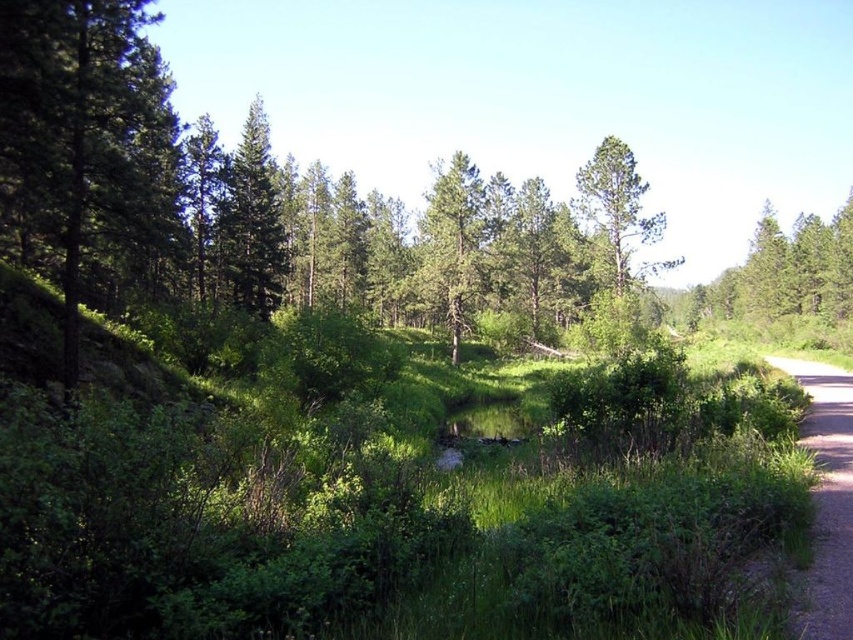
Question: Which object appears closest to the camera in this image?

Choices:
 (A) dirt/gravel path at right
 (B) green matte tree at upper left
 (C) green textured tree at center
 (D) green matte tree at left

Answer: (A)

Question: Considering the real-world distances, which object is closest to the dirt/gravel path at right?

Choices:
 (A) green matte tree at left
 (B) green matte tree at upper left
 (C) green textured tree at center

Answer: (A)

Question: Does dirt/gravel path at right lie behind green matte tree at upper left?

Choices:
 (A) no
 (B) yes

Answer: (A)

Question: Can you confirm if green matte tree at left is wider than green textured tree at center?

Choices:
 (A) no
 (B) yes

Answer: (B)

Question: Which point is farther to the camera?

Choices:
 (A) (250, 108)
 (B) (85, 36)

Answer: (A)

Question: Does green matte tree at upper left have a larger size compared to green textured tree at center?

Choices:
 (A) no
 (B) yes

Answer: (B)